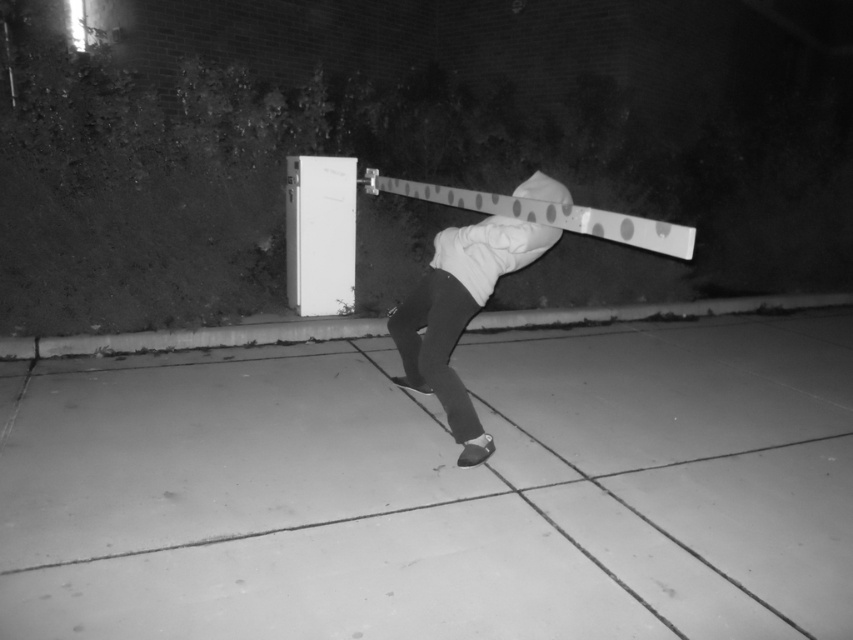
Question: Which point is farther to the camera?

Choices:
 (A) (781, 634)
 (B) (461, 298)

Answer: (B)

Question: Is smooth concrete pavement at center thinner than white matte hoodie at center?

Choices:
 (A) yes
 (B) no

Answer: (B)

Question: Can you confirm if smooth concrete pavement at center is positioned to the left of white matte hoodie at center?

Choices:
 (A) no
 (B) yes

Answer: (A)

Question: Which point appears farthest from the camera in this image?

Choices:
 (A) (440, 262)
 (B) (665, 493)

Answer: (A)

Question: Is smooth concrete pavement at center positioned before white matte hoodie at center?

Choices:
 (A) no
 (B) yes

Answer: (B)

Question: Which object is farther from the camera taking this photo?

Choices:
 (A) white matte hoodie at center
 (B) smooth concrete pavement at center

Answer: (A)